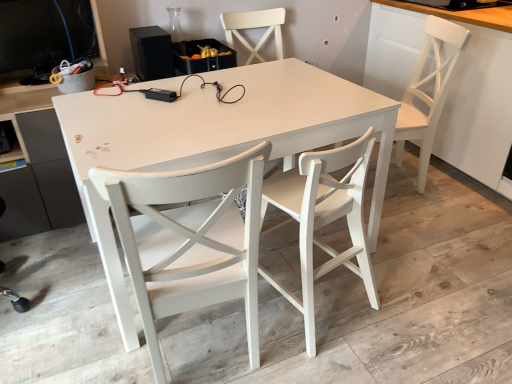
Where is `free spot below white wood chair at center, the second chair positioned from the right (from a real-world perspective)`? Image resolution: width=512 pixels, height=384 pixels. free spot below white wood chair at center, the second chair positioned from the right (from a real-world perspective) is located at coordinates (323, 302).